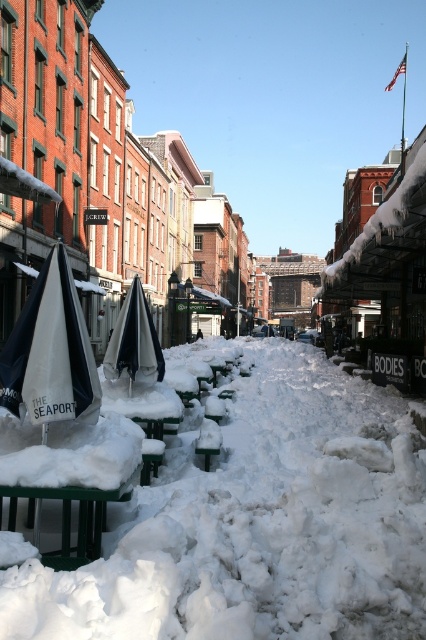
Question: Which object is farther from the camera taking this photo?

Choices:
 (A) white matte umbrella at center
 (B) white matte umbrella at left

Answer: (A)

Question: Considering the relative positions of white fluffy snow at center and white matte umbrella at center in the image provided, where is white fluffy snow at center located with respect to white matte umbrella at center?

Choices:
 (A) above
 (B) below

Answer: (B)

Question: Observing the image, what is the correct spatial positioning of white matte umbrella at left in reference to white matte umbrella at center?

Choices:
 (A) below
 (B) above

Answer: (A)

Question: Observing the image, what is the correct spatial positioning of white matte umbrella at left in reference to white matte umbrella at center?

Choices:
 (A) above
 (B) below

Answer: (B)

Question: Which of the following is the farthest from the observer?

Choices:
 (A) white fluffy snow at center
 (B) white matte umbrella at center

Answer: (B)

Question: Considering the real-world distances, which object is farthest from the white fluffy snow at center?

Choices:
 (A) white matte umbrella at center
 (B) white matte umbrella at left

Answer: (A)